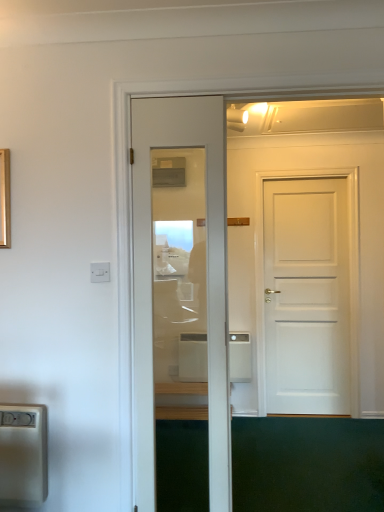
Question: Should I look upward or downward to see white plastic electric outlet at left?

Choices:
 (A) up
 (B) down

Answer: (B)